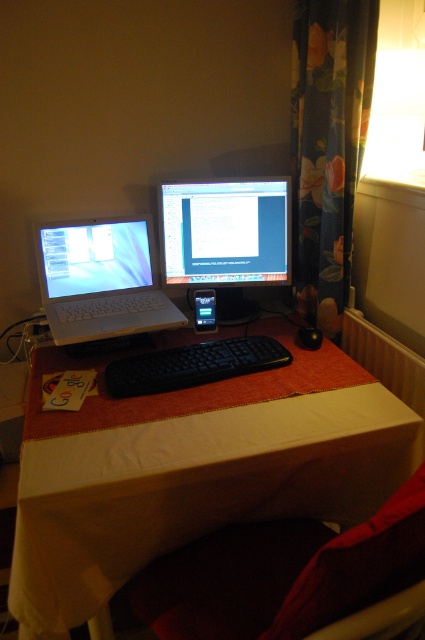
Question: Among these objects, which one is farthest from the camera?

Choices:
 (A) matte black monitor at center
 (B) dark fabric chair at lower center
 (C) white plastic laptop at left

Answer: (A)

Question: Which of the following is the closest to the observer?

Choices:
 (A) (187, 372)
 (B) (167, 572)
 (C) (326, 196)

Answer: (B)

Question: Which point is closer to the camera?

Choices:
 (A) matte black laptop at left
 (B) dark fabric chair at lower center

Answer: (B)

Question: Does dark fabric chair at lower center appear on the right side of black plastic mouse at center?

Choices:
 (A) no
 (B) yes

Answer: (A)

Question: Is matte black monitor at center to the right of black plastic mouse at center from the viewer's perspective?

Choices:
 (A) no
 (B) yes

Answer: (A)

Question: Is dark fabric chair at lower center positioned before white plastic laptop at left?

Choices:
 (A) no
 (B) yes

Answer: (B)